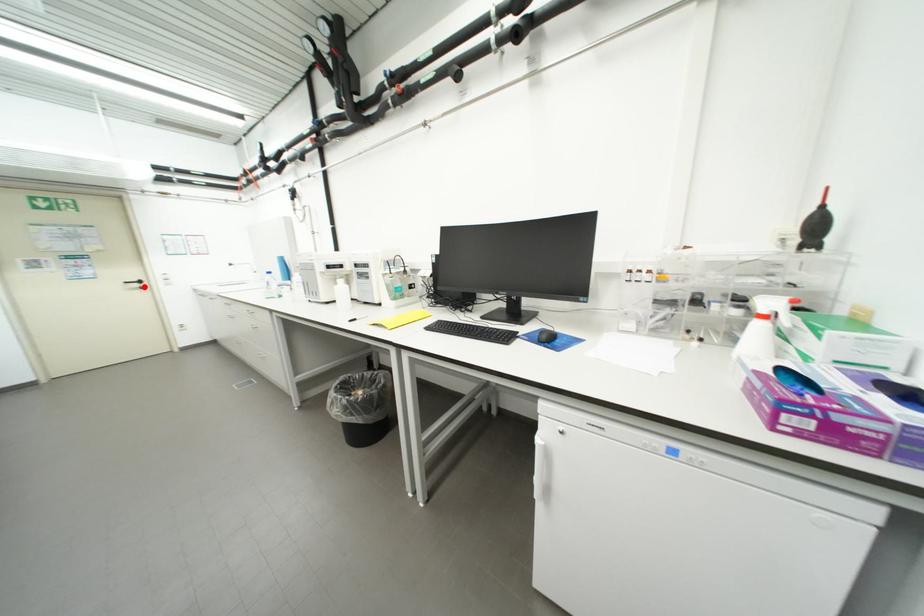
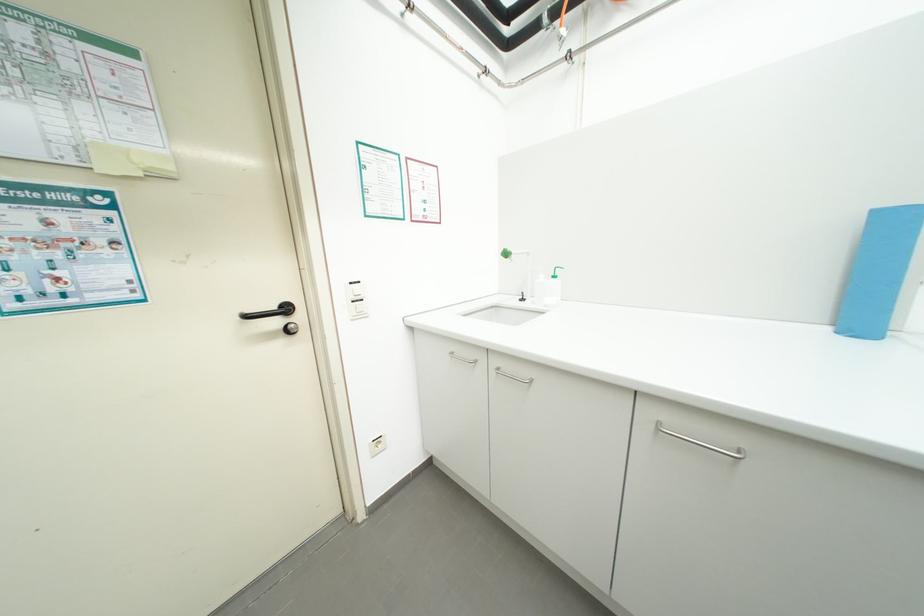
Question: I am providing you with two images of the same scene from different viewpoints. A red point is marked on the first image. At the location where the point appears in image 1, is it still visible in image 2?

Choices:
 (A) Yes
 (B) No

Answer: (A)